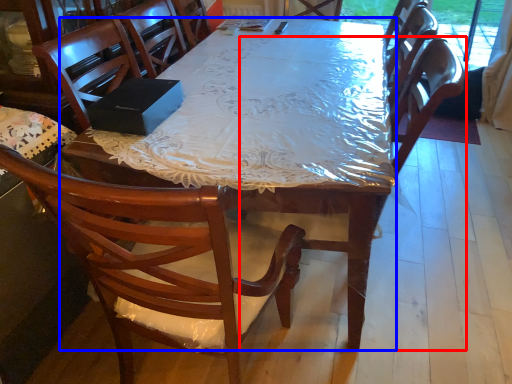
Question: Which object appears closest to the camera in this image, armchair (highlighted by a red box) or desk (highlighted by a blue box)?

Choices:
 (A) armchair
 (B) desk

Answer: (B)